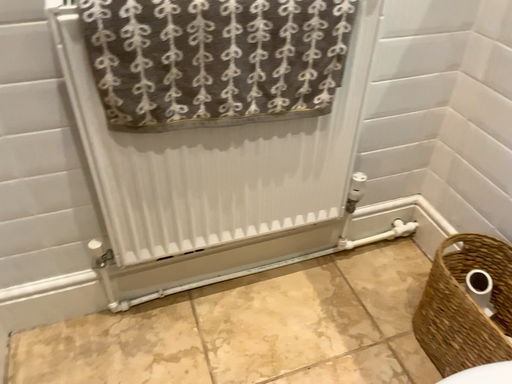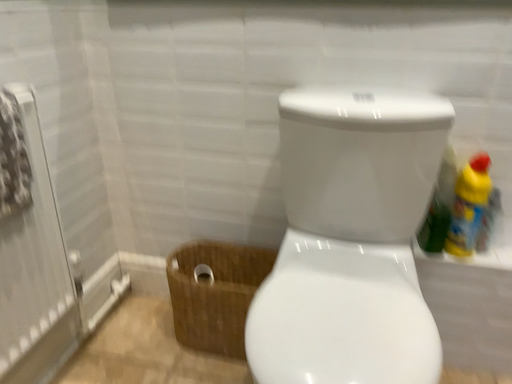
Question: How did the camera likely rotate when shooting the video?

Choices:
 (A) rotated right
 (B) rotated left

Answer: (A)